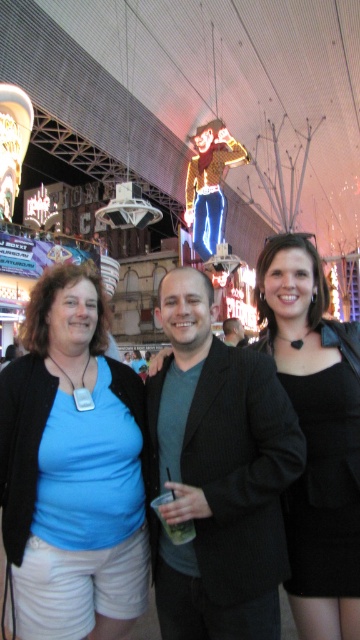
Question: Which of the following is the farthest from the observer?

Choices:
 (A) (343, 394)
 (B) (12, 445)
 (C) (169, 328)

Answer: (C)

Question: Can you confirm if blue fabric shirt at center is thinner than black matte dress at center?

Choices:
 (A) yes
 (B) no

Answer: (B)

Question: Can you confirm if blue fabric shirt at center is smaller than black matte dress at center?

Choices:
 (A) yes
 (B) no

Answer: (A)

Question: Is blue fabric shirt at center thinner than black matte dress at center?

Choices:
 (A) no
 (B) yes

Answer: (A)

Question: Which point appears closest to the camera in this image?

Choices:
 (A) (74, 364)
 (B) (285, 397)

Answer: (B)

Question: Which point is closer to the camera?

Choices:
 (A) matte black jacket at center
 (B) black matte dress at center
 (C) blue fabric shirt at center

Answer: (C)